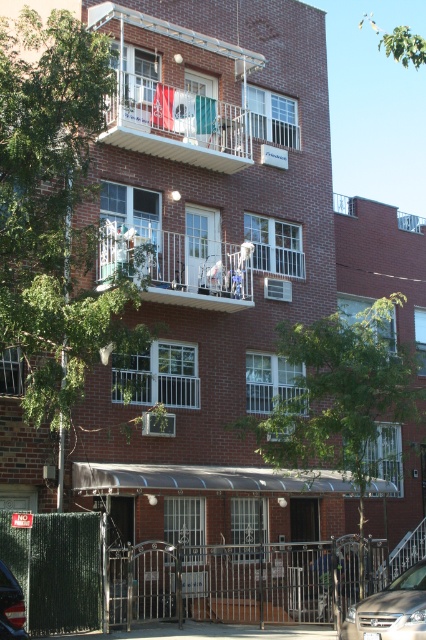
You are a delivery person trying to enter the courtyard through the partially open gate. The gate is narrow and only allows one vehicle or object at a time. Which object between the white plastic laundry at center and the silver metallic sedan at center can fit through the gate more easily?

The white plastic laundry at center has a lesser width compared to the silver metallic sedan at center, so it can fit through the gate more easily.